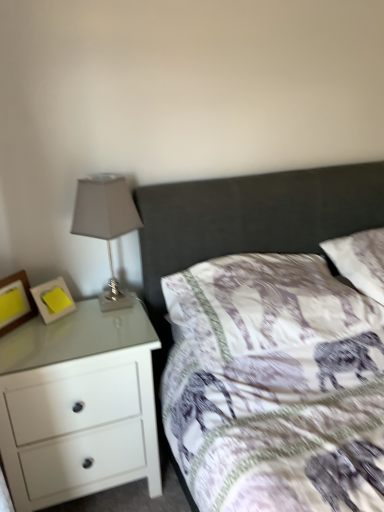
The height and width of the screenshot is (512, 384). What are the coordinates of `vacant space that is to the left of matte gray glass table lamp at left` in the screenshot? It's located at (56, 323).